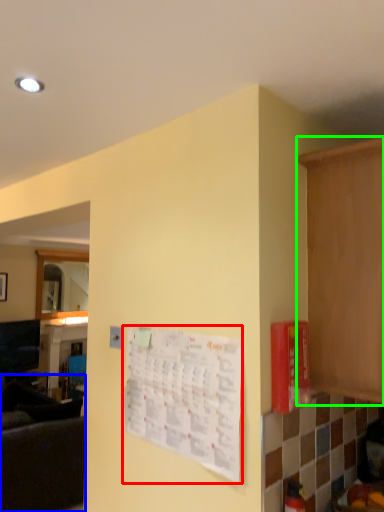
Question: Which object is positioned farthest from bulletin board (highlighted by a red box)? Select from couch (highlighted by a blue box) and cabinetry (highlighted by a green box).

Choices:
 (A) couch
 (B) cabinetry

Answer: (A)